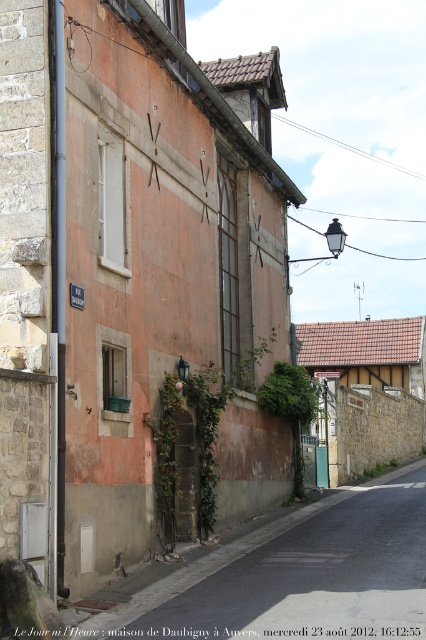
Does point (296, 384) lie in front of point (317, 449)?

Yes.

Who is positioned more to the right, green leafy ivy at center or green plastic sign at center?

Positioned to the right is green plastic sign at center.

Between point (296, 493) and point (325, 470), which one is positioned behind?

Point (325, 470)

The image size is (426, 640). What are the coordinates of `green leafy ivy at center` in the screenshot? It's located at (290, 406).